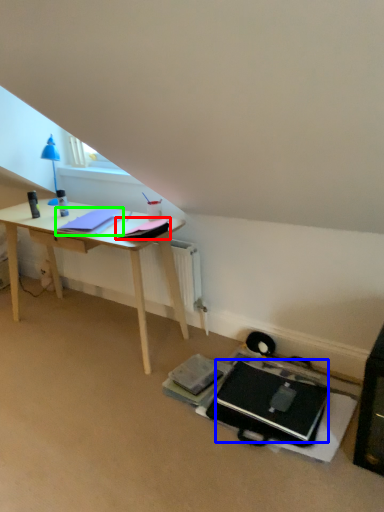
Question: Which object is the farthest from notepad (highlighted by a red box)? Choose among these: laptop (highlighted by a blue box) or notepad (highlighted by a green box).

Choices:
 (A) laptop
 (B) notepad

Answer: (A)